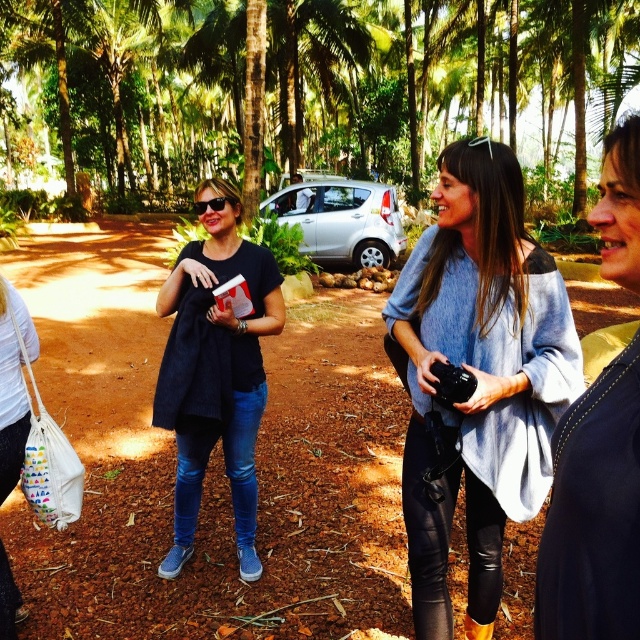
Who is positioned more to the right, green leafy tree at center or light blue sweater at center?

Positioned to the right is light blue sweater at center.

Can you confirm if green leafy tree at center is wider than light blue sweater at center?

Correct, the width of green leafy tree at center exceeds that of light blue sweater at center.

Between point (385, 145) and point (422, 548), which one is positioned in front?

Point (422, 548) is more forward.

Identify the location of green leafy tree at center. This screenshot has width=640, height=640. (307, 92).

Can you confirm if green leafy tree at center is bigger than denim jacket at center?

Correct, green leafy tree at center is larger in size than denim jacket at center.

Between green leafy tree at center and denim jacket at center, which one has less height?

With less height is denim jacket at center.

Identify the location of green leafy tree at center. Image resolution: width=640 pixels, height=640 pixels. (307, 92).

Is point (620, 614) positioned after point (250, 504)?

No, it is in front of (250, 504).

Is point (584, 531) farther from camera compared to point (221, 230)?

No, (584, 531) is closer to viewer.

Identify the location of denim jacket at center. (593, 513).